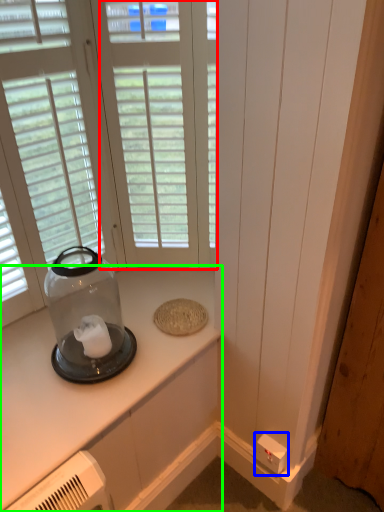
Question: Which object is positioned farthest from window (highlighted by a red box)? Select from electric outlet (highlighted by a blue box) and countertop (highlighted by a green box).

Choices:
 (A) electric outlet
 (B) countertop

Answer: (A)